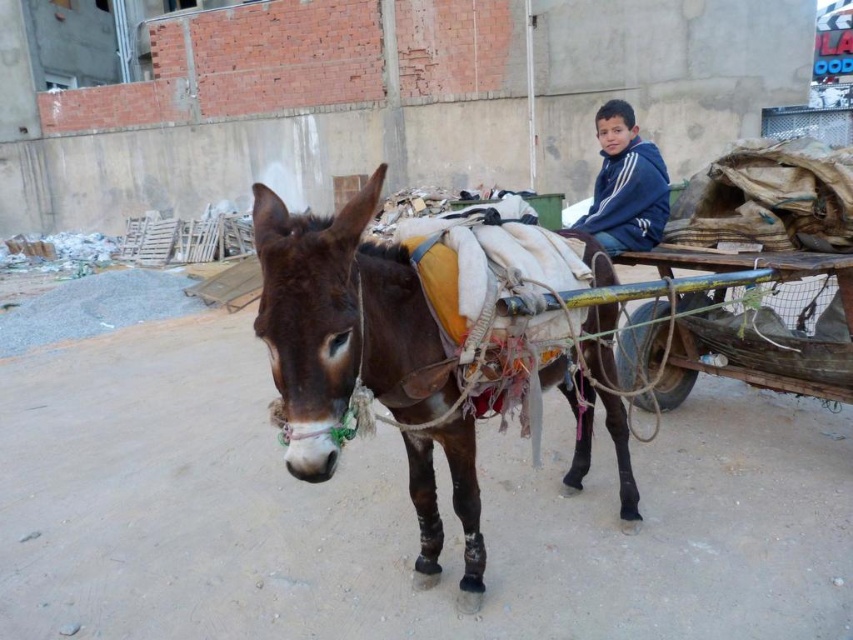
Question: Which point is farther to the camera?

Choices:
 (A) brown leather donkey at center
 (B) wooden cart at center

Answer: (B)

Question: Does brown leather donkey at center appear on the right side of blue fleece jacket at upper center?

Choices:
 (A) no
 (B) yes

Answer: (A)

Question: Which of the following is the farthest from the observer?

Choices:
 (A) (753, 378)
 (B) (361, 221)
 (C) (619, 241)

Answer: (C)

Question: Does brown leather donkey at center have a larger size compared to blue fleece jacket at upper center?

Choices:
 (A) yes
 (B) no

Answer: (A)

Question: Does brown leather donkey at center appear under blue fleece jacket at upper center?

Choices:
 (A) no
 (B) yes

Answer: (B)

Question: Which of these objects is positioned closest to the brown leather donkey at center?

Choices:
 (A) blue fleece jacket at upper center
 (B) wooden cart at center

Answer: (A)